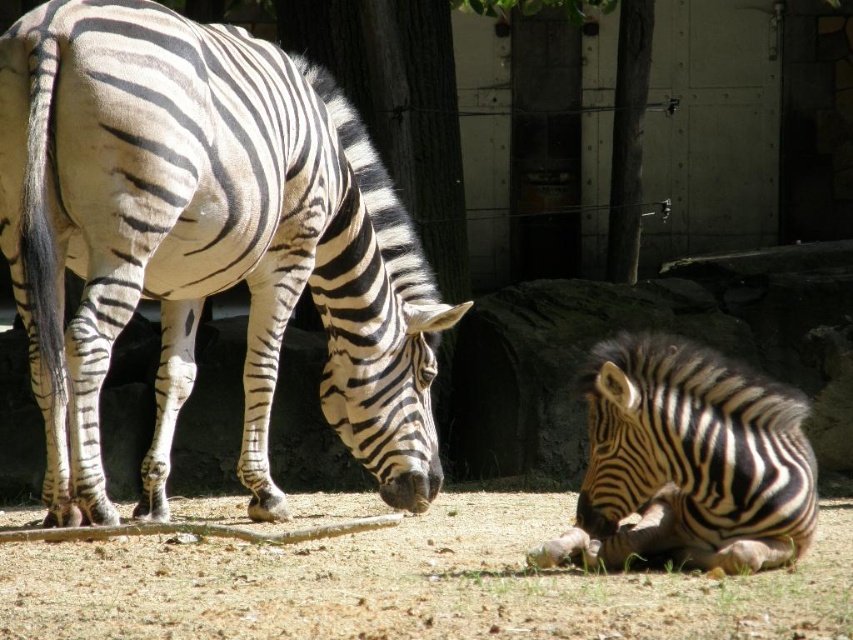
What are the coordinates of `green grass at lower center` in the screenshot? It's located at [x=412, y=586].

Is green grass at lower center smaller than smooth bark tree at center?

Incorrect, green grass at lower center is not smaller in size than smooth bark tree at center.

Between point (788, 620) and point (631, 106), which one is positioned in front?

Point (788, 620) is more forward.

Find the location of `green grass at lower center`. green grass at lower center is located at coordinates (412, 586).

How distant is green grass at lower center from black and white striped zebra at lower right?

green grass at lower center is 29.81 inches away from black and white striped zebra at lower right.

Between point (457, 630) and point (740, 499), which one is positioned in front?

Point (457, 630)

In order to click on green grass at lower center in this screenshot , I will do point(412,586).

Between black and white striped zebra at left and green grass at lower center, which one has less height?

green grass at lower center

Can you confirm if black and white striped zebra at left is bigger than green grass at lower center?

Yes, black and white striped zebra at left is bigger than green grass at lower center.

Who is more distant from viewer, (263, 93) or (48, 561)?

Point (263, 93)

Where is `black and white striped zebra at left`? The height and width of the screenshot is (640, 853). black and white striped zebra at left is located at coordinates (204, 241).